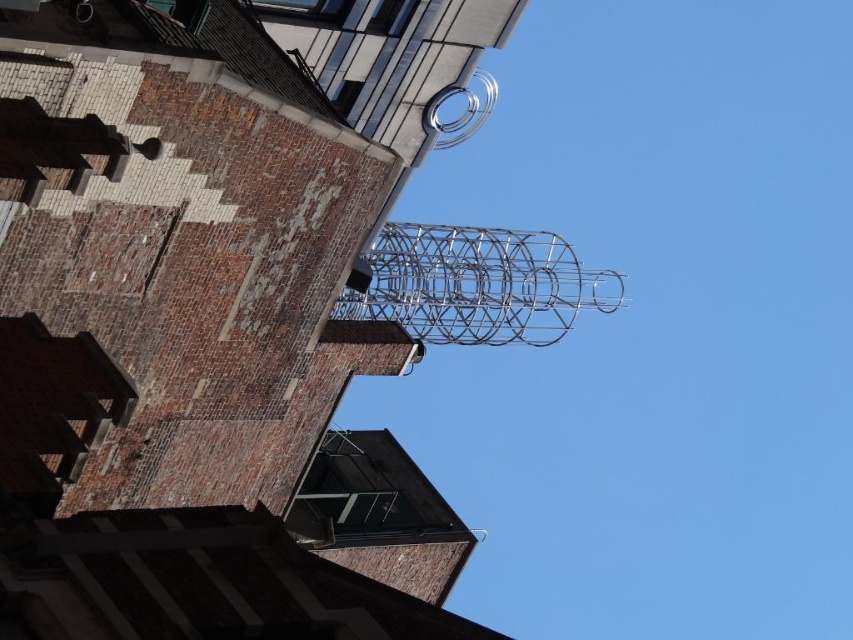
Question: Does silver metallic tower at upper center have a lesser width compared to silver metallic wire at upper center?

Choices:
 (A) no
 (B) yes

Answer: (B)

Question: Which point appears closest to the camera in this image?

Choices:
 (A) (341, 296)
 (B) (114, 120)

Answer: (B)

Question: Can you confirm if silver metallic tower at upper center is smaller than silver metallic wire at upper center?

Choices:
 (A) no
 (B) yes

Answer: (B)

Question: Does silver metallic tower at upper center lie behind silver metallic wire at upper center?

Choices:
 (A) no
 (B) yes

Answer: (A)

Question: Which object appears closest to the camera in this image?

Choices:
 (A) silver metallic wire at upper center
 (B) silver metallic tower at upper center

Answer: (B)